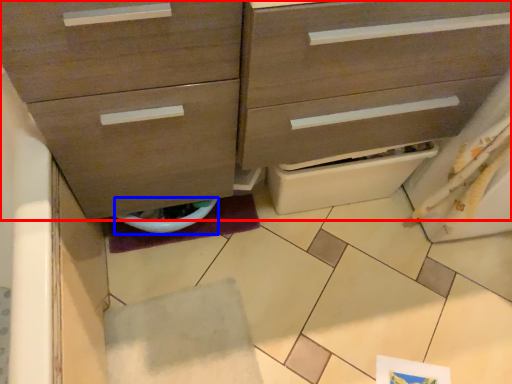
Question: Which object is further to the camera taking this photo, chest of drawers (highlighted by a red box) or toilet bowl (highlighted by a blue box)?

Choices:
 (A) chest of drawers
 (B) toilet bowl

Answer: (B)